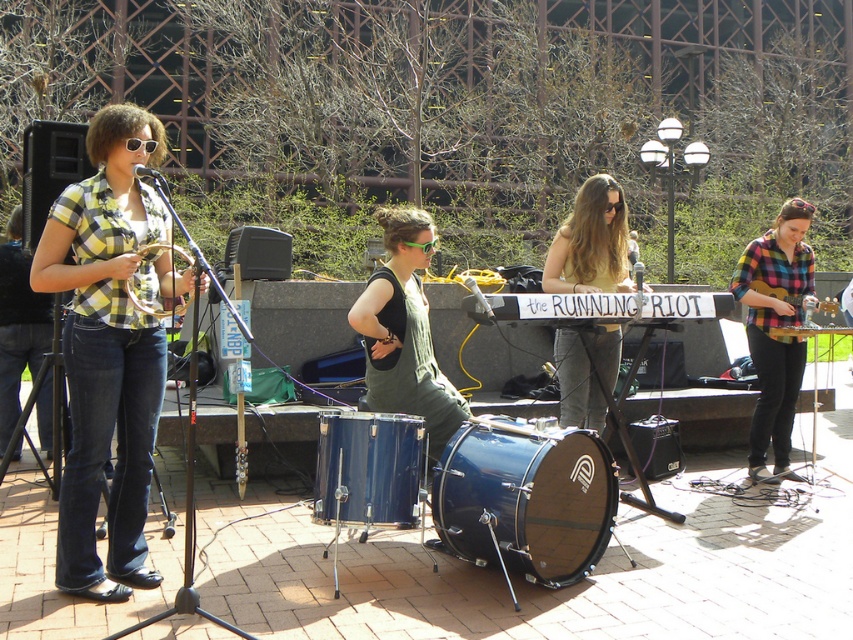
Question: Among these points, which one is farthest from the camera?

Choices:
 (A) (625, 209)
 (B) (781, 358)

Answer: (A)

Question: Estimate the real-world distances between objects in this image. Which object is farther from the metallic silver guitar at center-right?

Choices:
 (A) blue polished wood drum at center
 (B) matte green dress at center
 (C) checkered fabric shirt at left
 (D) glossy blue drum at center

Answer: (C)

Question: Which is farther from the checkered fabric shirt at left?

Choices:
 (A) glossy blue drum at center
 (B) gold brass trombone at center

Answer: (A)

Question: Is green fabric dress at center to the right of gold brass trombone at center from the viewer's perspective?

Choices:
 (A) yes
 (B) no

Answer: (A)

Question: Can you confirm if blue polished wood drum at center is wider than gold brass trombone at center?

Choices:
 (A) yes
 (B) no

Answer: (A)

Question: Can you confirm if blue polished wood drum at center is positioned to the right of green fabric dress at center?

Choices:
 (A) no
 (B) yes

Answer: (B)